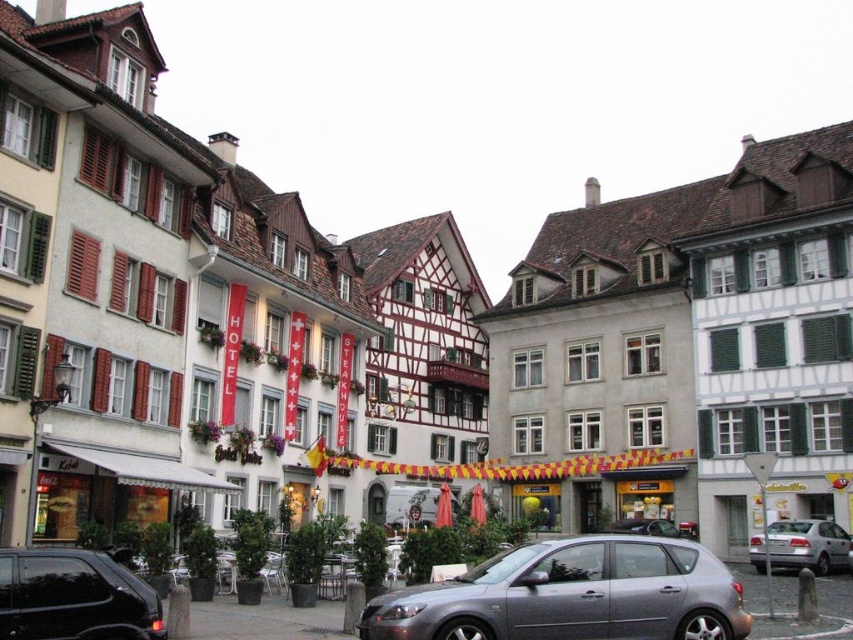
Between metallic gray hatchback at center and silver metallic hatchback at center, which one appears on the left side from the viewer's perspective?

metallic gray hatchback at center is more to the left.

Can you confirm if metallic gray hatchback at center is positioned to the left of silver metallic hatchback at center?

Indeed, metallic gray hatchback at center is positioned on the left side of silver metallic hatchback at center.

Locate an element on the screen. This screenshot has height=640, width=853. metallic gray hatchback at center is located at coordinates (572, 595).

Locate an element on the screen. The image size is (853, 640). silver metallic sedan at lower right is located at coordinates (799, 545).

Locate an element on the screen. This screenshot has width=853, height=640. silver metallic sedan at lower right is located at coordinates (x=799, y=545).

Looking at this image, does metallic gray hatchback at center have a greater height compared to shiny black car at lower left?

Indeed, metallic gray hatchback at center has a greater height compared to shiny black car at lower left.

Does point (490, 632) come behind point (24, 572)?

That is True.

What do you see at coordinates (572, 595) in the screenshot? This screenshot has height=640, width=853. I see `metallic gray hatchback at center` at bounding box center [572, 595].

Where is `metallic gray hatchback at center`? The image size is (853, 640). metallic gray hatchback at center is located at coordinates (572, 595).